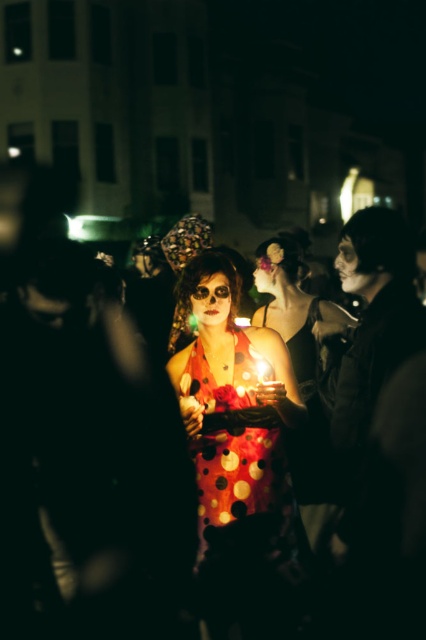
Question: Which point is farther to the camera?

Choices:
 (A) (147, 566)
 (B) (229, 445)

Answer: (A)

Question: Observing the image, what is the correct spatial positioning of polka dot dress at center in reference to polka dot fabric dress at center?

Choices:
 (A) above
 (B) below

Answer: (A)

Question: Does polka dot dress at center have a lesser width compared to polka dot fabric dress at center?

Choices:
 (A) yes
 (B) no

Answer: (B)

Question: Does polka dot dress at center appear over polka dot fabric dress at center?

Choices:
 (A) no
 (B) yes

Answer: (B)